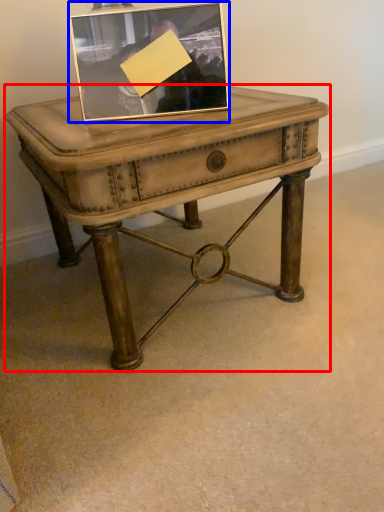
Question: Which point is further to the camera, table (highlighted by a red box) or picture frame (highlighted by a blue box)?

Choices:
 (A) table
 (B) picture frame

Answer: (B)